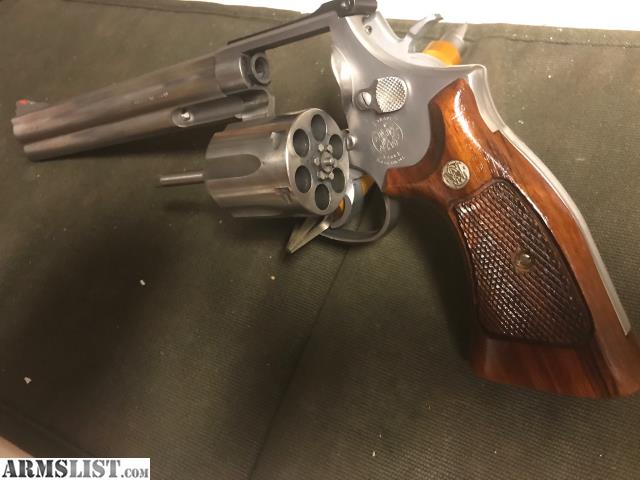
Locate an element on the screen. table is located at coordinates (326, 317), (580, 129), (70, 58).